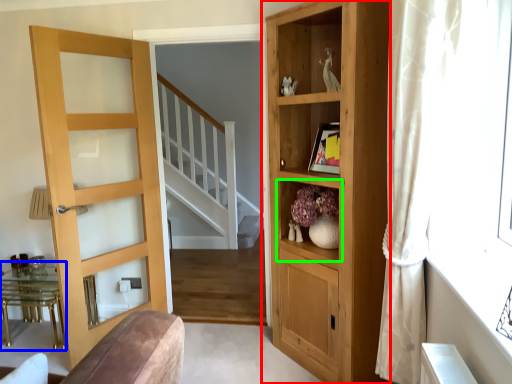
Question: Which object is the farthest from cupboard (highlighted by a red box)? Choose among these: table (highlighted by a blue box) or shelf (highlighted by a green box).

Choices:
 (A) table
 (B) shelf

Answer: (A)